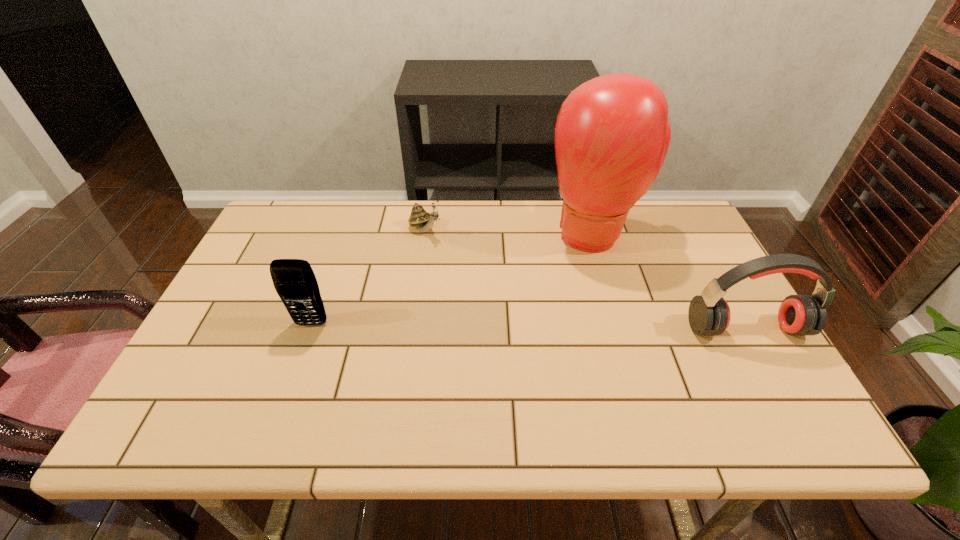
The width and height of the screenshot is (960, 540). Find the location of `free space located on the face of the snail`. free space located on the face of the snail is located at coordinates (516, 295).

Identify the location of vacant region located 0.200m on the striking surface of the tallest object. (585, 316).

I want to click on vacant space located 0.070m on the striking surface of the tallest object, so click(x=588, y=281).

Identify the location of free space located 0.370m on the striking surface of the tallest object. This screenshot has width=960, height=540. (580, 371).

Image resolution: width=960 pixels, height=540 pixels. I want to click on snail situated at the far edge, so coord(424,221).

Identify the location of boxing glove at the far edge. This screenshot has height=540, width=960. (612, 134).

Identify the location of earphone located at the right edge. This screenshot has width=960, height=540. [x=709, y=314].

I want to click on boxing glove at the right edge, so click(x=612, y=134).

The image size is (960, 540). In order to click on object at the far right corner in this screenshot , I will do `click(612, 134)`.

In the image, there is a desktop. Find the location of `free space at the far edge`. free space at the far edge is located at coordinates (395, 202).